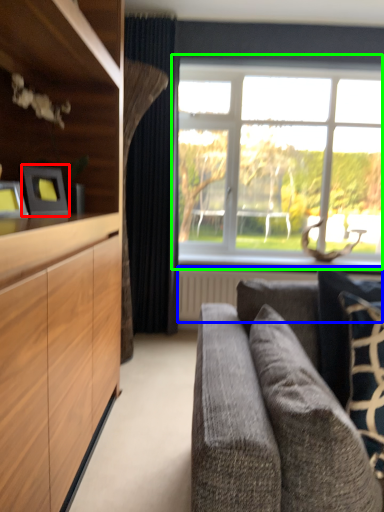
Question: Which is farther away from picture frame (highlighted by a red box)? radiator (highlighted by a blue box) or window (highlighted by a green box)?

Choices:
 (A) radiator
 (B) window

Answer: (B)